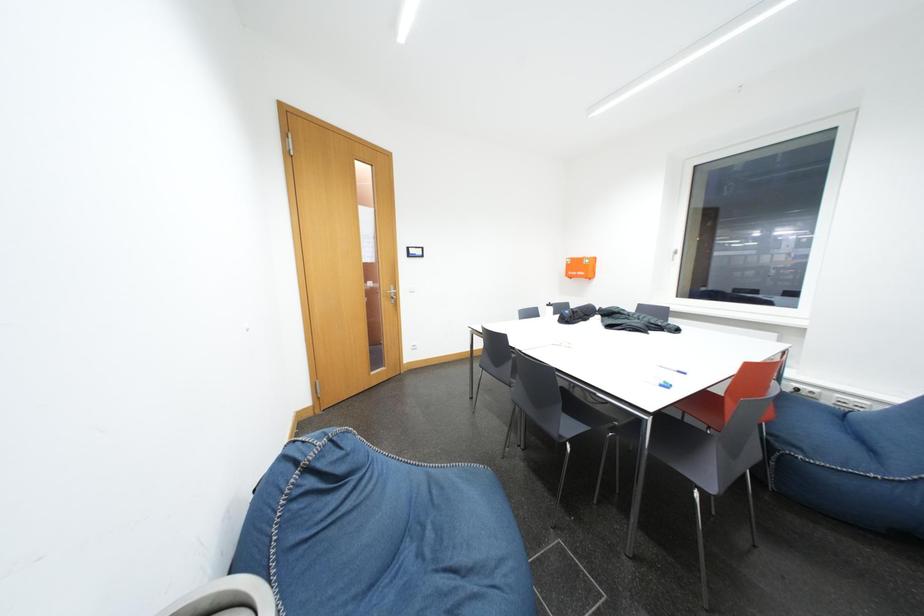
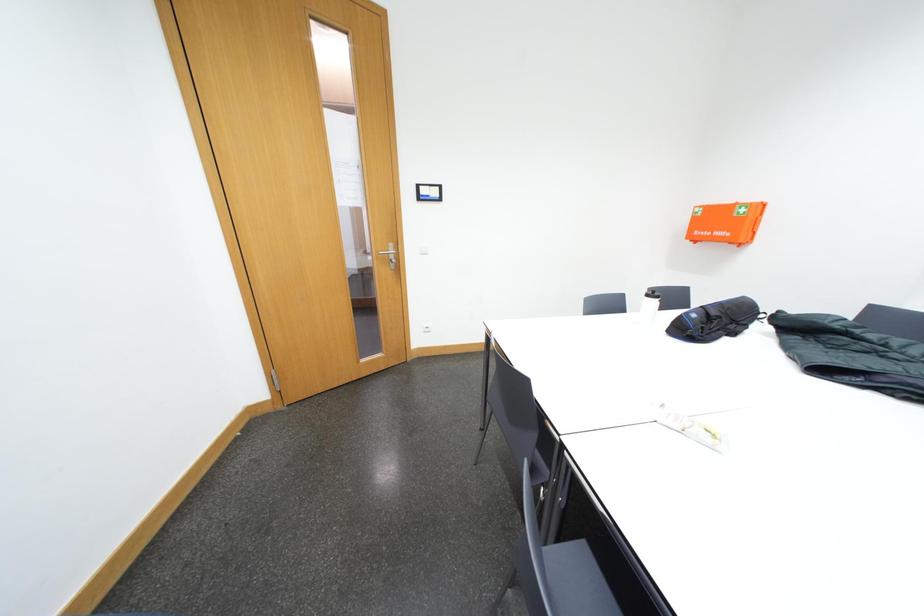
Question: The images are taken continuously from a first-person perspective. In which direction are you moving?

Choices:
 (A) Left
 (B) Right
 (C) Forward
 (D) Backward

Answer: (C)